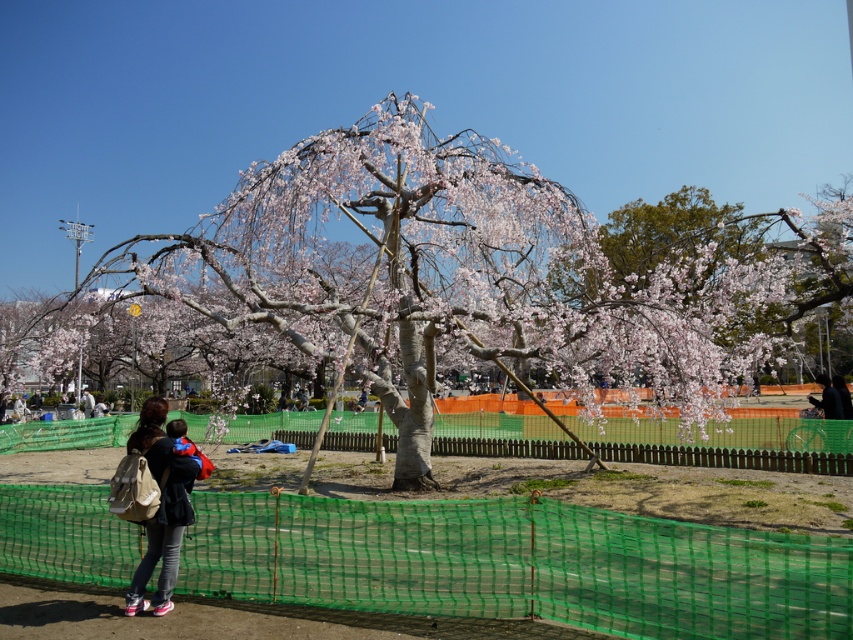
Question: Which point is farther to the camera?

Choices:
 (A) (329, 136)
 (B) (830, 416)
 (C) (412, 560)
 (D) (140, 445)

Answer: (B)

Question: Is pink blossoming tree at center thinner than dark blue shirt at center?

Choices:
 (A) no
 (B) yes

Answer: (A)

Question: Can you confirm if green mesh net at lower center is bigger than matte beige backpack at lower left?

Choices:
 (A) no
 (B) yes

Answer: (B)

Question: Which point appears farthest from the camera in this image?

Choices:
 (A) (113, 572)
 (B) (387, 273)
 (C) (822, 387)

Answer: (C)

Question: Can you confirm if green mesh net at lower center is smaller than matte beige backpack at lower left?

Choices:
 (A) yes
 (B) no

Answer: (B)

Question: Which object is positioned farthest from the matte beige backpack at lower left?

Choices:
 (A) green mesh net at lower center
 (B) dark blue shirt at center
 (C) pink blossoming tree at center

Answer: (C)